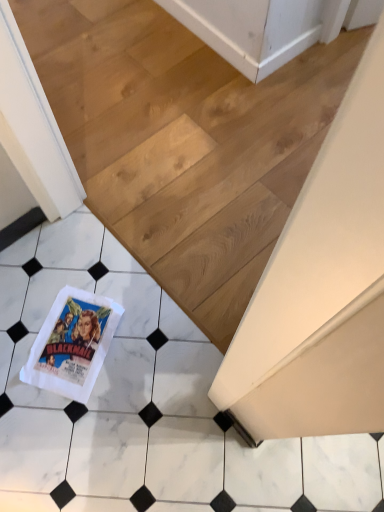
Question: Should I look upward or downward to see white marble tile at lower left?

Choices:
 (A) up
 (B) down

Answer: (A)

Question: From a real-world perspective, is white marble tile at lower left located beneath white marble tile at lower left?

Choices:
 (A) yes
 (B) no

Answer: (A)

Question: From the image's perspective, is white marble tile at lower left below white marble tile at lower left?

Choices:
 (A) no
 (B) yes

Answer: (A)

Question: Could white marble tile at lower left be considered to be inside white marble tile at lower left?

Choices:
 (A) yes
 (B) no

Answer: (B)

Question: Does white marble tile at lower left come in front of white marble tile at lower left?

Choices:
 (A) no
 (B) yes

Answer: (A)

Question: Is white marble tile at lower left outside of white marble tile at lower left?

Choices:
 (A) yes
 (B) no

Answer: (A)

Question: Does white marble tile at lower left come behind white marble tile at lower left?

Choices:
 (A) yes
 (B) no

Answer: (A)

Question: Is white marble tile at lower left behind white marble tile at lower left?

Choices:
 (A) yes
 (B) no

Answer: (B)

Question: Does white marble tile at lower left have a larger size compared to white marble tile at lower left?

Choices:
 (A) yes
 (B) no

Answer: (B)

Question: Can you confirm if white marble tile at lower left is taller than white marble tile at lower left?

Choices:
 (A) yes
 (B) no

Answer: (B)

Question: Is white marble tile at lower left smaller than white marble tile at lower left?

Choices:
 (A) no
 (B) yes

Answer: (B)

Question: From the image's perspective, would you say white marble tile at lower left is positioned over white marble tile at lower left?

Choices:
 (A) yes
 (B) no

Answer: (B)

Question: Is white marble tile at lower left shorter than white marble tile at lower left?

Choices:
 (A) yes
 (B) no

Answer: (A)

Question: Can you confirm if white marble tile at lower left is shorter than white paper towel at lower left?

Choices:
 (A) yes
 (B) no

Answer: (B)